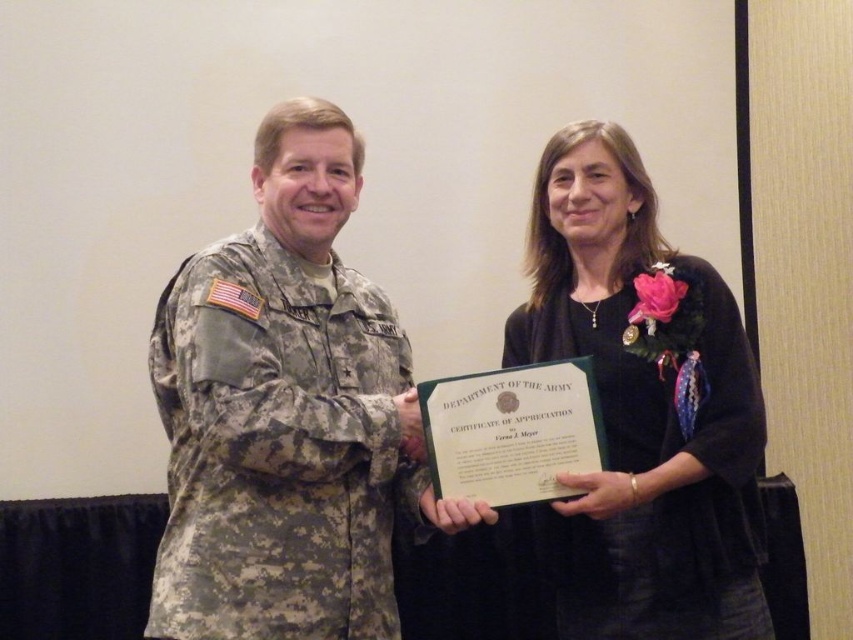
Describe the element at coordinates (282, 412) in the screenshot. I see `camouflage uniform at center` at that location.

Does camouflage uniform at center have a larger size compared to matte black uniform at center?

Yes.

Is point (169, 323) positioned before point (630, 460)?

Yes, it is.

This screenshot has height=640, width=853. Identify the location of camouflage uniform at center. (282, 412).